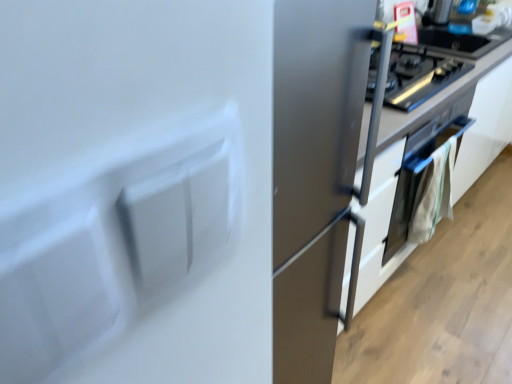
Question: From the image's perspective, would you say satin silver oven at upper right is positioned over satin white cabinet at center?

Choices:
 (A) no
 (B) yes

Answer: (B)

Question: From a real-world perspective, is satin silver oven at upper right located beneath satin white cabinet at center?

Choices:
 (A) yes
 (B) no

Answer: (B)

Question: Is satin white cabinet at center surrounded by satin silver oven at upper right?

Choices:
 (A) no
 (B) yes

Answer: (A)

Question: Is satin silver oven at upper right not within satin white cabinet at center?

Choices:
 (A) yes
 (B) no

Answer: (B)

Question: Considering the relative sizes of satin silver oven at upper right and satin white cabinet at center in the image provided, is satin silver oven at upper right bigger than satin white cabinet at center?

Choices:
 (A) yes
 (B) no

Answer: (B)

Question: Is satin white cabinet at center taller or shorter than white matte refrigerator at center?

Choices:
 (A) tall
 (B) short

Answer: (B)

Question: Visually, is satin white cabinet at center positioned to the left or to the right of white matte refrigerator at center?

Choices:
 (A) left
 (B) right

Answer: (B)

Question: From a real-world perspective, is satin white cabinet at center above or below white matte refrigerator at center?

Choices:
 (A) below
 (B) above

Answer: (A)

Question: Is satin white cabinet at center situated inside white matte refrigerator at center or outside?

Choices:
 (A) outside
 (B) inside

Answer: (A)

Question: Is satin silver oven at upper right situated inside satin white cabinet at center or outside?

Choices:
 (A) inside
 (B) outside

Answer: (A)

Question: Is satin silver oven at upper right in front of or behind satin white cabinet at center in the image?

Choices:
 (A) front
 (B) behind

Answer: (B)

Question: Does point (395, 52) appear closer or farther from the camera than point (394, 125)?

Choices:
 (A) farther
 (B) closer

Answer: (A)

Question: From the image's perspective, relative to satin white cabinet at center, is satin silver oven at upper right above or below?

Choices:
 (A) above
 (B) below

Answer: (A)

Question: Is satin silver oven at lower right bigger or smaller than white matte refrigerator at center?

Choices:
 (A) small
 (B) big

Answer: (A)

Question: Considering the positions of point (385, 244) and point (26, 104), is point (385, 244) closer or farther from the camera than point (26, 104)?

Choices:
 (A) farther
 (B) closer

Answer: (A)